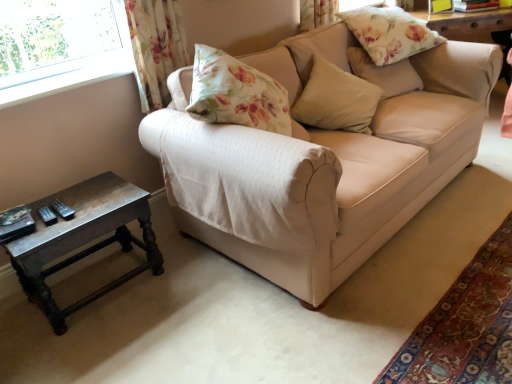
Question: From a real-world perspective, is floral fabric curtain at upper left positioned over dark brown wooden table at lower left based on gravity?

Choices:
 (A) no
 (B) yes

Answer: (B)

Question: Could dark brown wooden table at lower left be considered to be inside floral fabric curtain at upper left?

Choices:
 (A) yes
 (B) no

Answer: (B)

Question: From the image's perspective, is floral fabric curtain at upper left located above dark brown wooden table at lower left?

Choices:
 (A) yes
 (B) no

Answer: (A)

Question: Can you confirm if floral fabric curtain at upper left is thinner than dark brown wooden table at lower left?

Choices:
 (A) no
 (B) yes

Answer: (B)

Question: Does floral fabric curtain at upper left appear on the right side of dark brown wooden table at lower left?

Choices:
 (A) yes
 (B) no

Answer: (A)

Question: Considering the relative positions of floral fabric curtain at upper left and dark brown wooden table at lower left in the image provided, is floral fabric curtain at upper left to the left of dark brown wooden table at lower left from the viewer's perspective?

Choices:
 (A) yes
 (B) no

Answer: (B)

Question: Is beige fabric couch at center thinner than floral fabric pillow at upper right, the first pillow in the top-to-bottom sequence?

Choices:
 (A) yes
 (B) no

Answer: (B)

Question: Can you confirm if beige fabric couch at center is wider than floral fabric pillow at upper right, which is the third pillow from bottom to top?

Choices:
 (A) yes
 (B) no

Answer: (A)

Question: Is beige fabric couch at center bigger than floral fabric pillow at upper right, the first pillow in the top-to-bottom sequence?

Choices:
 (A) yes
 (B) no

Answer: (A)

Question: Is beige fabric couch at center surrounding floral fabric pillow at upper right, the first pillow in the top-to-bottom sequence?

Choices:
 (A) no
 (B) yes

Answer: (B)

Question: Can you confirm if beige fabric couch at center is shorter than floral fabric pillow at upper right, which is the third pillow from bottom to top?

Choices:
 (A) no
 (B) yes

Answer: (A)

Question: Would you consider beige fabric couch at center to be distant from floral fabric pillow at upper right, the first pillow in the top-to-bottom sequence?

Choices:
 (A) yes
 (B) no

Answer: (B)

Question: Can you confirm if floral fabric pillow at upper right, placed as the second pillow when sorted from bottom to top, is shorter than dark brown wooden table at lower left?

Choices:
 (A) yes
 (B) no

Answer: (A)